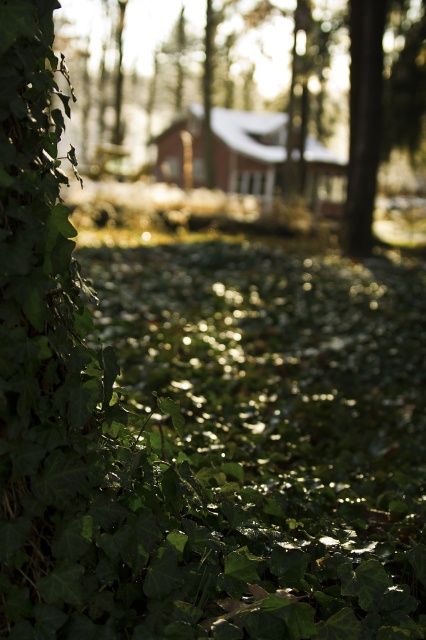
You are a hiker who needs to reach the wooden cabin at center. There is a green leafy tree at left blocking your path. Can you walk around it? Explain your reasoning based on the distance provided.

The distance between the green leafy tree at left and the wooden cabin at center is 3.75 feet. Since the tree is blocking the path, you can walk around it as the distance allows enough space to maneuver around the tree and reach the cabin.

You are standing in the natural setting described. You see a green leafy tree at left represented by the point (356, 132). If you want to take a photo of the tree, where should you position yourself relative to the tree?

The green leafy tree at left is represented by the point (356, 132), so you should position yourself to the right of the tree to capture it in your photo.

You are standing in a garden and want to take a photo of the green leafy tree at left. If your camera has a maximum focus range of 12 meters, will it be able to capture the tree clearly?

The distance between the green leafy tree at left and the camera is 12.60 meters, which exceeds the camera maximum focus range of 12 meters. Therefore, the camera cannot capture the tree clearly.